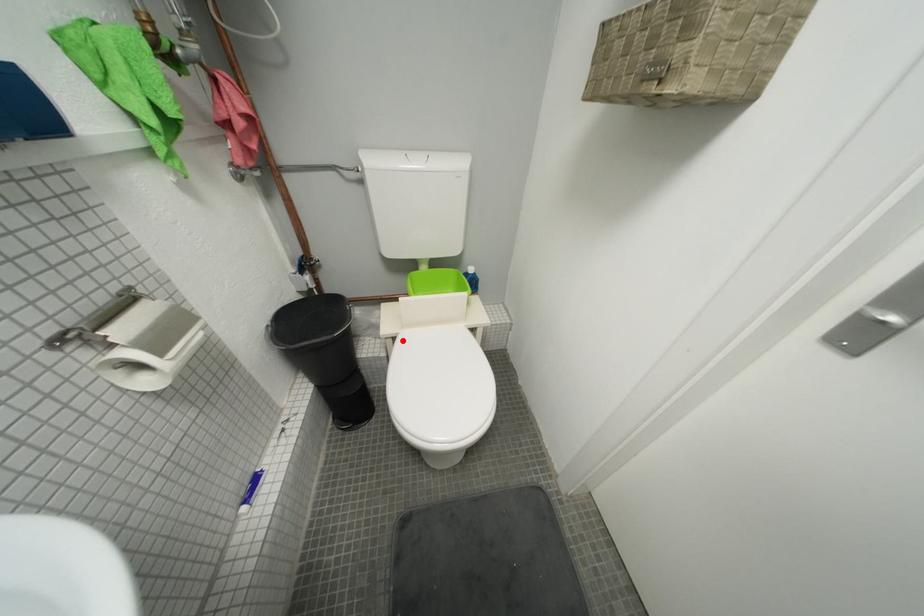
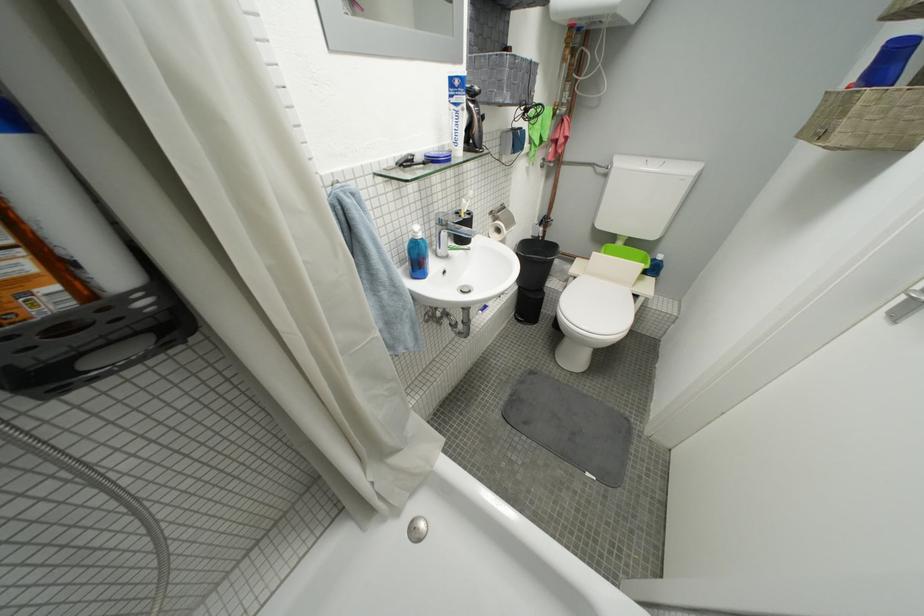
Question: I am providing you with two images of the same scene from different viewpoints. Given a red point in image1, look at the same physical point in image2. Is it:

Choices:
 (A) Closer to the viewpoint
 (B) Farther from the viewpoint

Answer: (A)